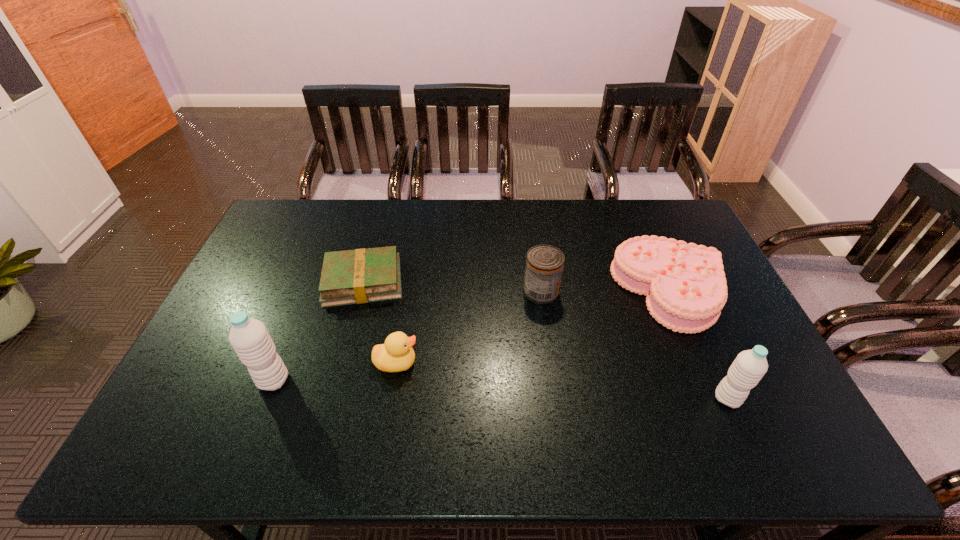
To ensure equal spacing by inserting another water_bottle among them, please point out a vacant spot for this new water_bottle. Please provide its 2D coordinates. Your answer should be formatted as a tuple, i.e. [(x, y)], where the tuple contains the x and y coordinates of a point satisfying the conditions above.

[(496, 389)]